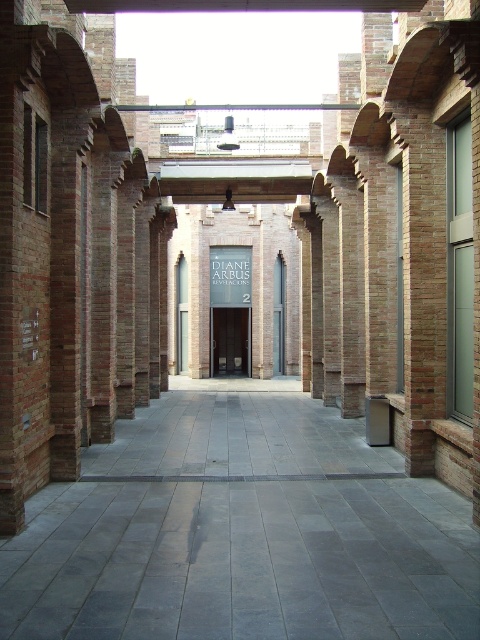
You are an art enthusiast visiting an exhibition. You see the gray concrete path at center and the black wooden door at center. Which one is closer to you?

The gray concrete path at center is closer because it is shorter than the black wooden door at center, meaning it is nearer to the observer.

You are standing in the corridor of the architectural structure described. There are two points marked in the scene, one at coordinates point (322,556) and another at point (238,348). Which of these two points is nearer to your current position?

Point (322,556) is closer to the viewer than point (238,348), so the point at coordinates point (322,556) is nearer to your current position.

You are an architect designing a new exhibition space. You need to place a large sculpture that requires a minimum of 3 meters in width. The sculpture must be placed either on the gray concrete path at center or against the black wooden door at center. Based on the scene, which location would be suitable?

The black wooden door at center is larger in size than the gray concrete path at center, so placing the sculpture against the black wooden door at center would be suitable as it likely meets the width requirement.